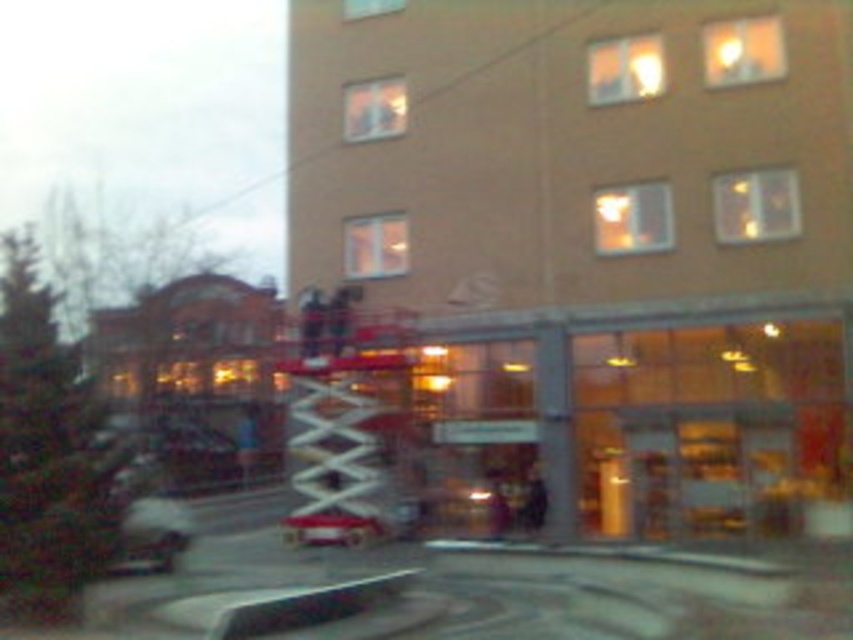
You are a fire truck driver who needs to park your white metallic fire truck at center as close as possible to the building without blocking the entrance. Based on the scene, what is the minimum distance you can park the fire truck from the building?

Result: The minimum distance you can park the white metallic fire truck at center from the building is 28.53 meters, as that is the closest it can be without blocking the entrance according to the scene description.

You are a delivery driver who needs to park your truck, which is as wide as the metallic silver car at lower left, in a spot that can accommodate its width. Based on the scene, is there a suitable parking space available near the white metallic fire truck at center?

The white metallic fire truck at center occupies less space than the metallic silver car at lower left, so the parking space near the white metallic fire truck at center may not be wide enough to accommodate the delivery truck since the metallic silver car at lower left is wider.

You are a pedestrian trying to cross the street in front of the building. There is a white metallic fire truck at center blocking the path. Can you see the metallic silver car at lower left from your current position?

The metallic silver car at lower left is behind the white metallic fire truck at center, so it is not visible from your current position in front of the building.